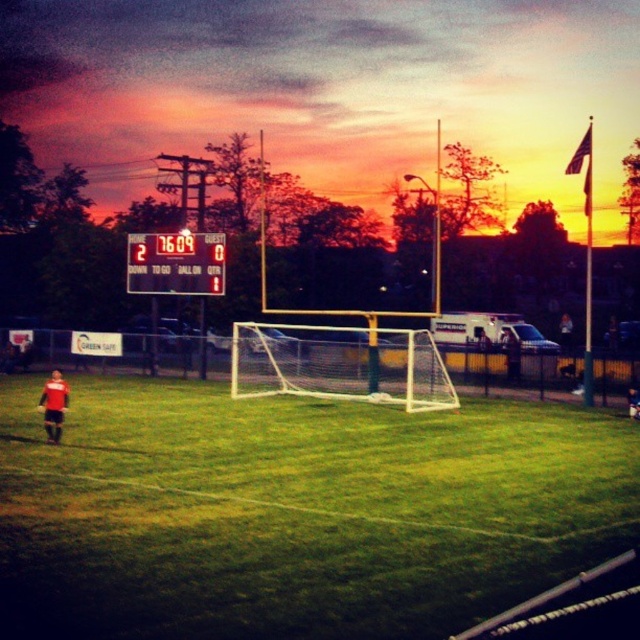
You are a soccer player standing on the edge of the field. You want to kick a ball to the goalpost located at the center of the green grass soccer field at center. Considering the distance between you and the field, can you reach the ball to the goalpost without stepping onto the field?

The green grass soccer field at center and viewer are 8.44 meters apart from each other. Since you are standing on the edge of the field, the distance between you and the goalpost is less than 8.44 meters. A soccer player can easily kick a ball that distance, so yes, you can reach the ball to the goalpost without stepping onto the field.

You are a soccer player standing at the point with coordinates point (177,442) and want to pass the ball to your teammate located at point (131,250). Considering the positions of the two points, which direction should you pass the ball to reach your teammate?

You should pass the ball towards the direction of point (131,250), as it is behind point (177,442). Since point (177,442) is in front of point (131,250), passing towards the teammate requires moving the ball backward from your current position.